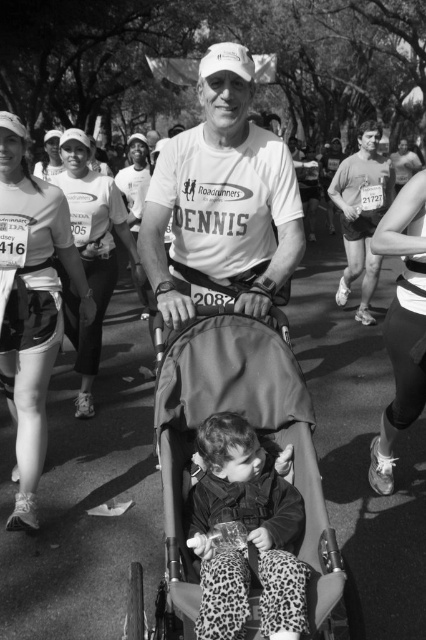
Who is taller, dark gray fabric stroller at center or matte white tank top at left?

matte white tank top at left is taller.

Does point (166, 628) lie behind point (14, 525)?

No, it is not.

What do you see at coordinates (264, 448) in the screenshot? The width and height of the screenshot is (426, 640). I see `dark gray fabric stroller at center` at bounding box center [264, 448].

Image resolution: width=426 pixels, height=640 pixels. In order to click on dark gray fabric stroller at center in this screenshot , I will do `click(264, 448)`.

Does leopard print pants at center have a greater width compared to smooth skin runner at right?

In fact, leopard print pants at center might be narrower than smooth skin runner at right.

Is point (250, 467) positioned before point (386, 205)?

Yes, point (250, 467) is closer to viewer.

Identify the location of leopard print pants at center. (247, 532).

Is leopard print pants at center positioned at the back of matte white shirt at upper center?

No, it is not.

Can you confirm if leopard print pants at center is shorter than matte white shirt at upper center?

Yes.

Between point (242, 513) and point (114, 257), which one is positioned behind?

The point (114, 257) is more distant.

Find the location of a particular element. The width and height of the screenshot is (426, 640). leopard print pants at center is located at coordinates (247, 532).